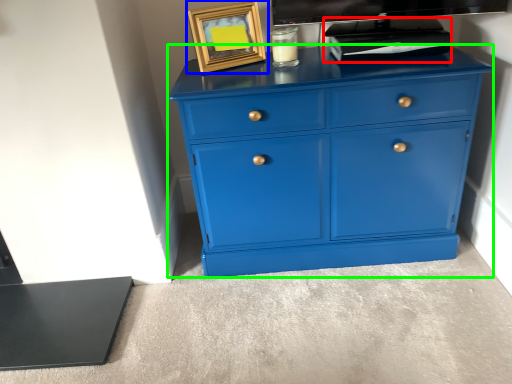
Question: Based on their relative distances, which object is farther from appliance (highlighted by a red box)? Choose from picture frame (highlighted by a blue box) and chest of drawers (highlighted by a green box).

Choices:
 (A) picture frame
 (B) chest of drawers

Answer: (A)